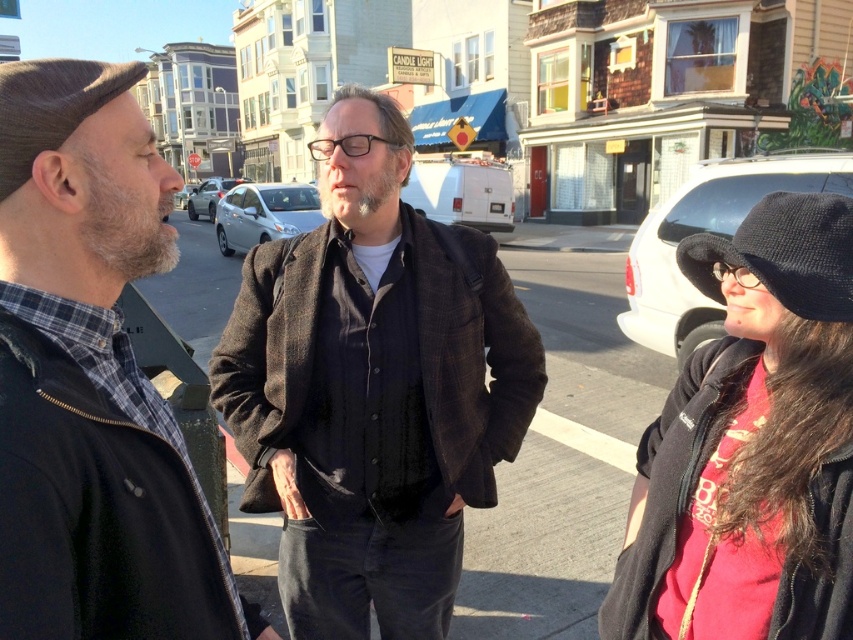
Question: Is plaid fabric shirt at left to the left of knit black hat at right from the viewer's perspective?

Choices:
 (A) yes
 (B) no

Answer: (A)

Question: Is the position of dark brown woolen jacket at center less distant than that of plaid fabric shirt at left?

Choices:
 (A) no
 (B) yes

Answer: (A)

Question: Which object appears farthest from the camera in this image?

Choices:
 (A) dark brown leather hat at left
 (B) black knit hat at right
 (C) plaid fabric shirt at left
 (D) knit black hat at right

Answer: (B)

Question: Which object is positioned farthest from the dark brown woolen jacket at center?

Choices:
 (A) black knit hat at right
 (B) dark brown leather hat at left
 (C) knit black hat at right

Answer: (B)

Question: Does plaid fabric shirt at left appear under knit black hat at right?

Choices:
 (A) no
 (B) yes

Answer: (A)

Question: Which is farther from the black knit hat at right?

Choices:
 (A) dark brown leather hat at left
 (B) dark brown woolen jacket at center
 (C) knit black hat at right
 (D) plaid fabric shirt at left

Answer: (A)